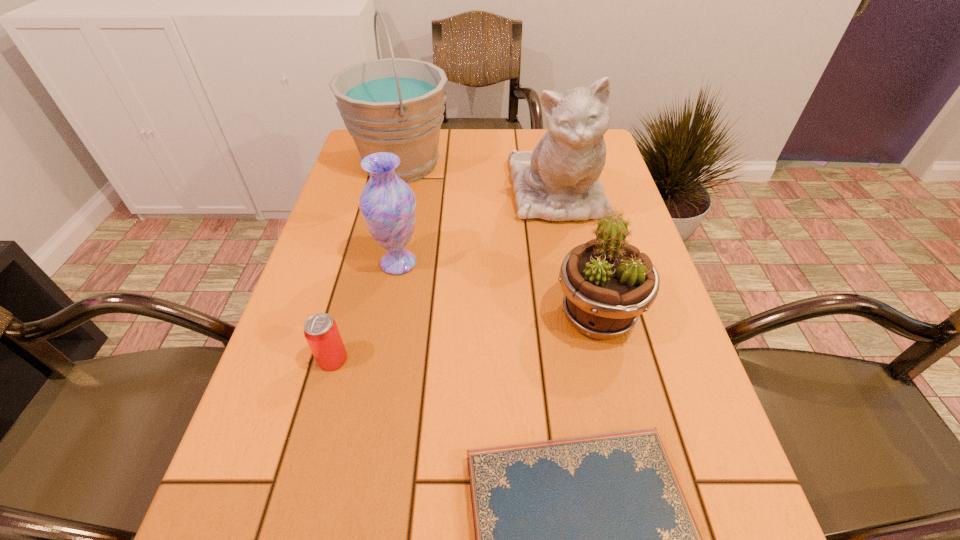
In the image, there is a desktop. Where is `free space at the right edge`? Image resolution: width=960 pixels, height=540 pixels. free space at the right edge is located at coordinates (666, 309).

The height and width of the screenshot is (540, 960). Identify the location of vacant area that lies between the third farthest object and the flowerpot. (498, 289).

I want to click on vacant area between the second shortest object and the bucket, so click(x=367, y=261).

Locate an element on the screen. The height and width of the screenshot is (540, 960). empty location between the cat and the can is located at coordinates (445, 276).

Identify the location of blank region between the cat and the vase. The width and height of the screenshot is (960, 540). (478, 228).

Identify the location of unoccupied area between the fifth tallest object and the bucket. The width and height of the screenshot is (960, 540). (367, 261).

You are a GUI agent. You are given a task and a screenshot of the screen. Output one action in this format:
    pyautogui.click(x=<x>, y=<y>)
    Task: Click on the free point between the vase and the flowerpot
    Image resolution: width=960 pixels, height=540 pixels.
    Given the screenshot: What is the action you would take?
    pyautogui.click(x=498, y=289)

Locate an element on the screen. This screenshot has width=960, height=540. empty location between the fourth nearest object and the second shortest object is located at coordinates (366, 311).

Identify which object is the fifth nearest to the cat. Please provide its 2D coordinates. Your answer should be formatted as a tuple, i.e. [(x, y)], where the tuple contains the x and y coordinates of a point satisfying the conditions above.

[(590, 539)]

Locate which object ranks fifth in proximity to the flowerpot. Please provide its 2D coordinates. Your answer should be formatted as a tuple, i.e. [(x, y)], where the tuple contains the x and y coordinates of a point satisfying the conditions above.

[(396, 105)]